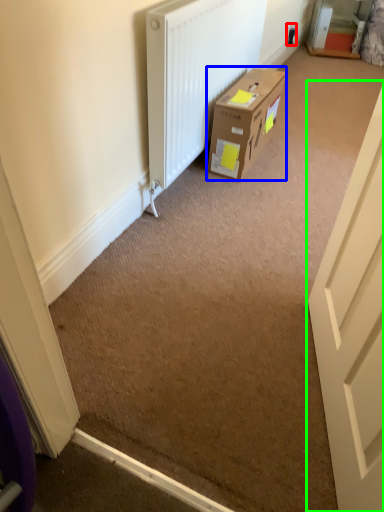
Question: Which is farther away from electric outlet (highlighted by a red box)? box (highlighted by a blue box) or door (highlighted by a green box)?

Choices:
 (A) box
 (B) door

Answer: (B)